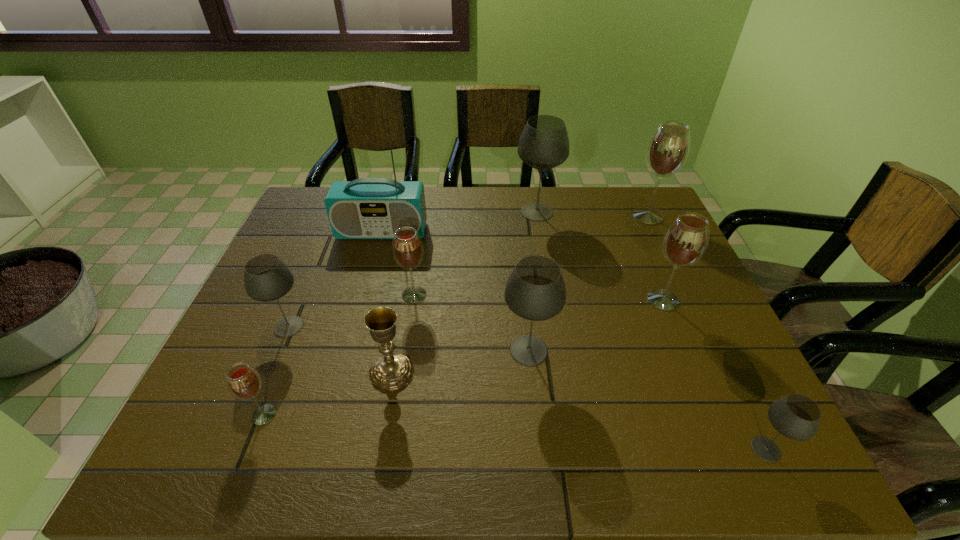
The image size is (960, 540). In order to click on empty space between the farthest red wineglass and the tallest object in this screenshot , I will do `click(515, 224)`.

Locate an element on the screen. This screenshot has height=540, width=960. unoccupied area between the second biggest red wineglass and the third smallest gray wineglass is located at coordinates (596, 325).

I want to click on vacant area that lies between the farthest red wineglass and the nearest gray wineglass, so click(707, 333).

Image resolution: width=960 pixels, height=540 pixels. I want to click on blank region between the third biggest gray wineglass and the biggest gray wineglass, so click(x=413, y=269).

This screenshot has width=960, height=540. Find the location of `object identified as the eighth closest to the smallest gray wineglass`. object identified as the eighth closest to the smallest gray wineglass is located at coordinates (244, 383).

Find the location of `the ninth closest object to the farthest gray wineglass`. the ninth closest object to the farthest gray wineglass is located at coordinates (244, 383).

Identify which wineglass is the seventh nearest to the second biggest red wineglass. Please provide its 2D coordinates. Your answer should be formatted as a tuple, i.e. [(x, y)], where the tuple contains the x and y coordinates of a point satisfying the conditions above.

[(244, 383)]

Identify which wineglass is located as the seventh nearest to the second biggest gray wineglass. Please provide its 2D coordinates. Your answer should be formatted as a tuple, i.e. [(x, y)], where the tuple contains the x and y coordinates of a point satisfying the conditions above.

[(668, 149)]

Select which gray wineglass is the third closest to the second biggest red wineglass. Please provide its 2D coordinates. Your answer should be formatted as a tuple, i.e. [(x, y)], where the tuple contains the x and y coordinates of a point satisfying the conditions above.

[(544, 144)]

What are the coordinates of `the third closest gray wineglass to the second biggest gray wineglass` in the screenshot? It's located at (266, 278).